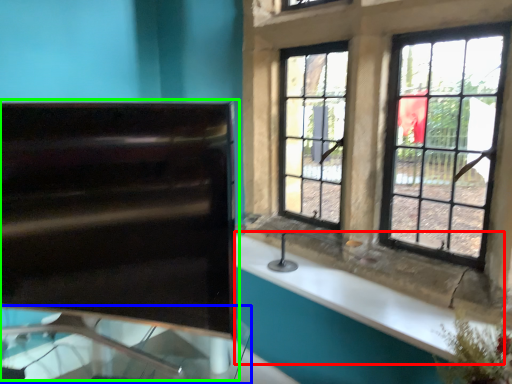
Question: Which object is the farthest from counter top (highlighted by a red box)? Choose among these: glass table (highlighted by a blue box) or sink (highlighted by a green box).

Choices:
 (A) glass table
 (B) sink

Answer: (B)